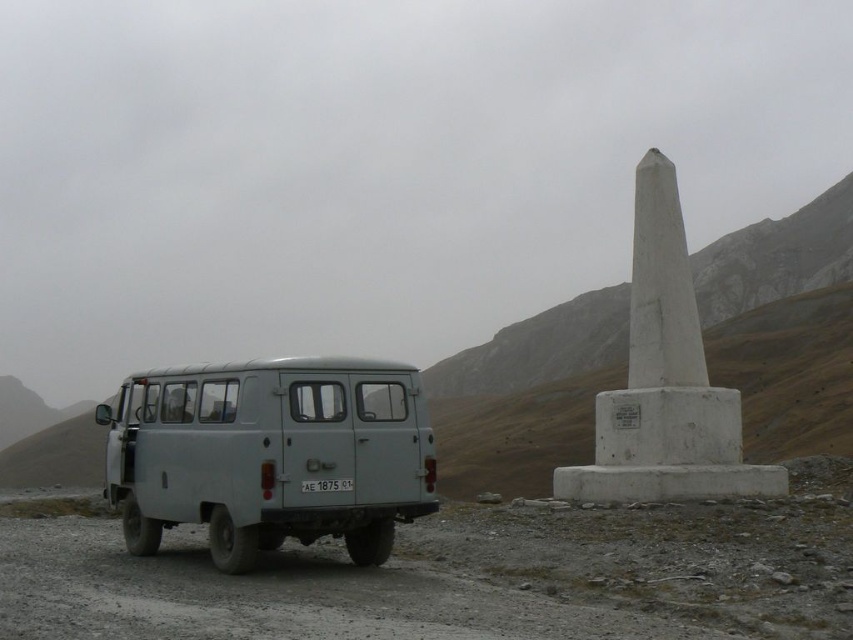
Question: Estimate the real-world distances between objects in this image. Which object is farther from the white concrete obelisk at right?

Choices:
 (A) matte gray van at left
 (B) white plastic license plate at center

Answer: (B)

Question: Does matte gray van at left have a lesser width compared to white concrete obelisk at right?

Choices:
 (A) no
 (B) yes

Answer: (B)

Question: Is white concrete obelisk at right further to the viewer compared to white plastic license plate at center?

Choices:
 (A) no
 (B) yes

Answer: (B)

Question: Which of these objects is positioned closest to the white concrete obelisk at right?

Choices:
 (A) white plastic license plate at center
 (B) matte gray van at left

Answer: (B)

Question: Which point is closer to the camera taking this photo?

Choices:
 (A) (320, 486)
 (B) (242, 419)

Answer: (B)

Question: Observing the image, what is the correct spatial positioning of matte gray van at left in reference to white plastic license plate at center?

Choices:
 (A) left
 (B) right

Answer: (A)